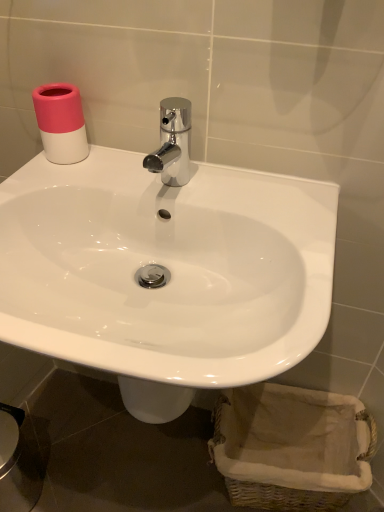
Identify the location of vacant point to the left of chrome metallic faucet at center. (96, 178).